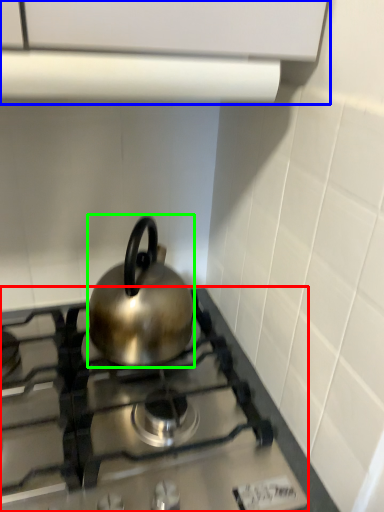
Question: Considering the real-world distances, which object is closest to gas stove (highlighted by a red box)? vent (highlighted by a blue box) or kettle (highlighted by a green box).

Choices:
 (A) vent
 (B) kettle

Answer: (B)